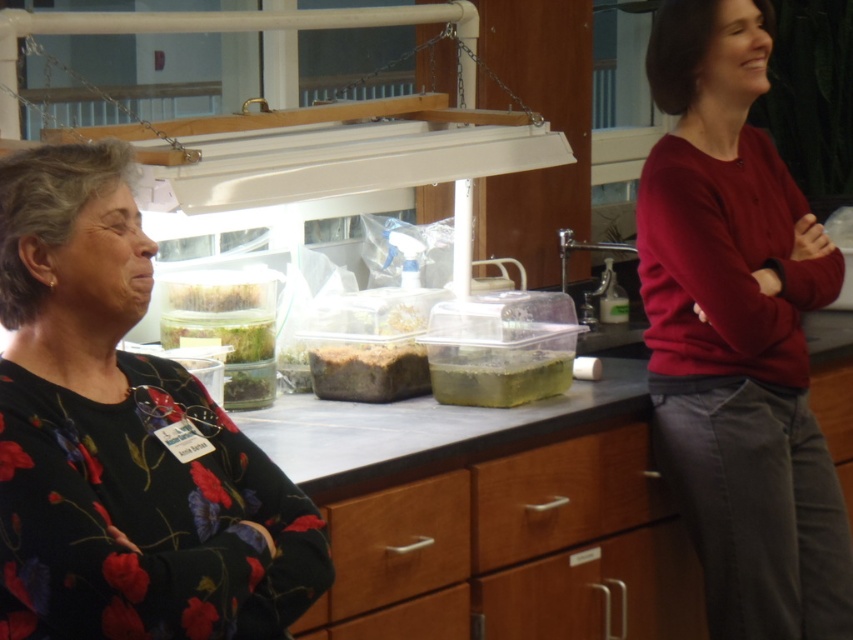
You are a researcher in the lab and need to access the brown matte soil at center. Is the matte red sweater at right blocking your direct path to it?

The matte red sweater at right is in front of the brown matte soil at center, so yes, the sweater is blocking the direct path to the soil.

You are a researcher in the lab and need to store a new sample of soil. The translucent plastic container at center and the brown matte soil at center are available. Which container can hold more soil?

The translucent plastic container at center has a larger size compared to brown matte soil at center, so it can hold more soil.